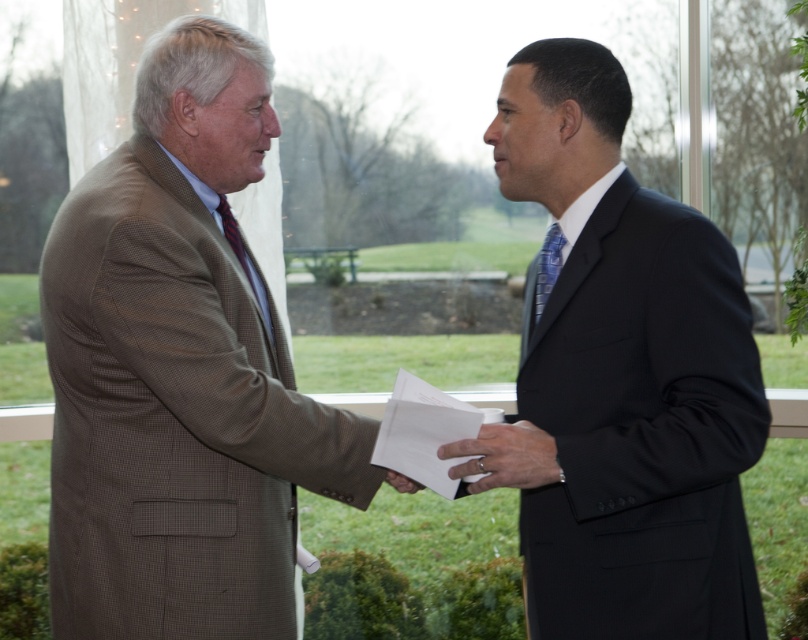
Image resolution: width=808 pixels, height=640 pixels. What do you see at coordinates (505, 456) in the screenshot? I see `matte black hand at center` at bounding box center [505, 456].

Can you confirm if matte black hand at center is taller than white paper at center?

Correct, matte black hand at center is much taller as white paper at center.

Who is more distant from viewer, (546, 460) or (415, 490)?

The point (415, 490) is behind.

You are a GUI agent. You are given a task and a screenshot of the screen. Output one action in this format:
    pyautogui.click(x=<x>, y=<y>)
    Task: Click on the matte black hand at center
    This screenshot has height=640, width=808.
    Given the screenshot: What is the action you would take?
    pyautogui.click(x=505, y=456)

Is black pinstripe suit at center wider than matte black hand at center?

Yes.

Where is `black pinstripe suit at center`? Image resolution: width=808 pixels, height=640 pixels. black pinstripe suit at center is located at coordinates (626, 372).

Is black pinstripe suit at center in front of white paper at center?

Yes, black pinstripe suit at center is in front of white paper at center.

Does point (687, 340) come closer to viewer compared to point (419, 490)?

Yes, point (687, 340) is closer to viewer.

What do you see at coordinates (626, 372) in the screenshot?
I see `black pinstripe suit at center` at bounding box center [626, 372].

This screenshot has height=640, width=808. Find the location of `black pinstripe suit at center`. black pinstripe suit at center is located at coordinates (626, 372).